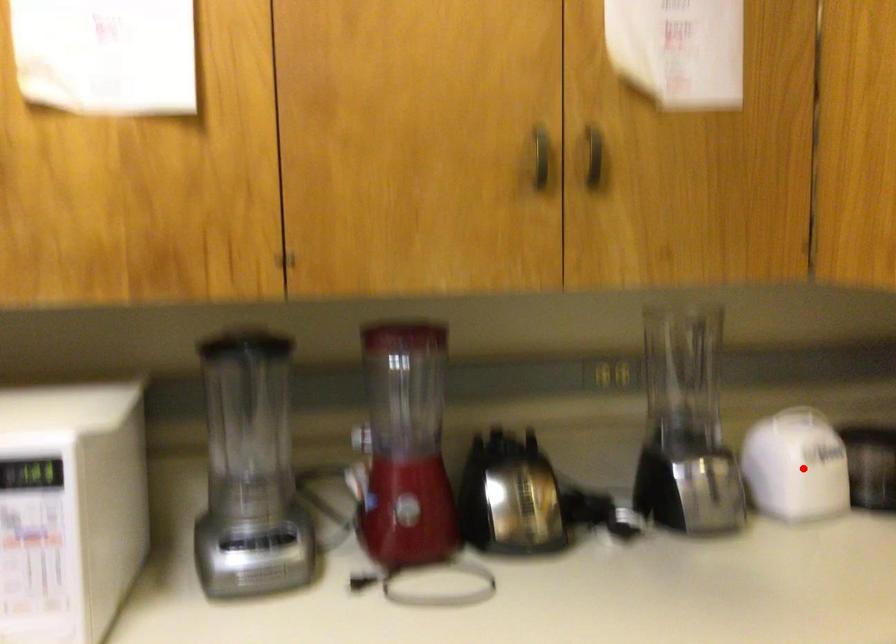
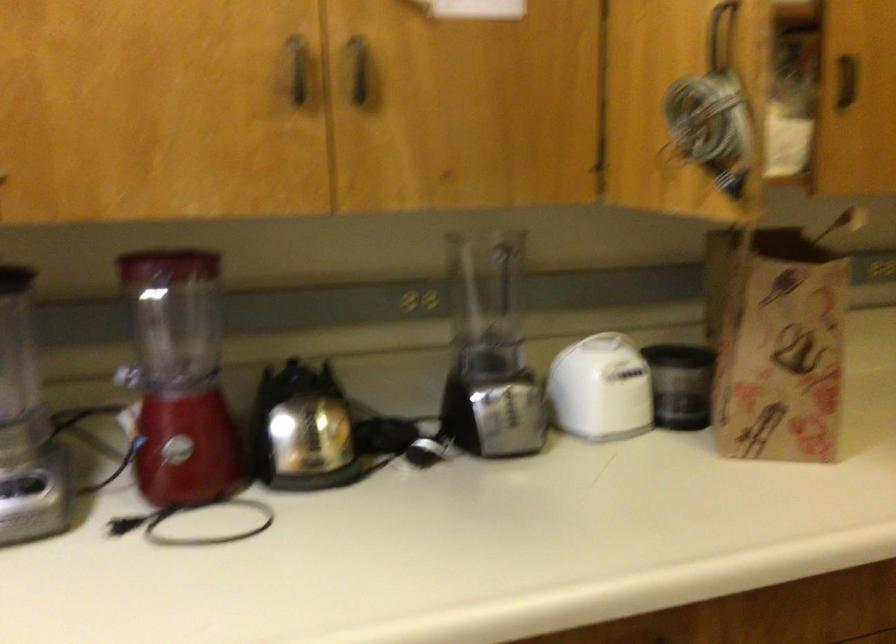
In the second image, find the point that corresponds to the highlighted location in the first image.

(600, 389)